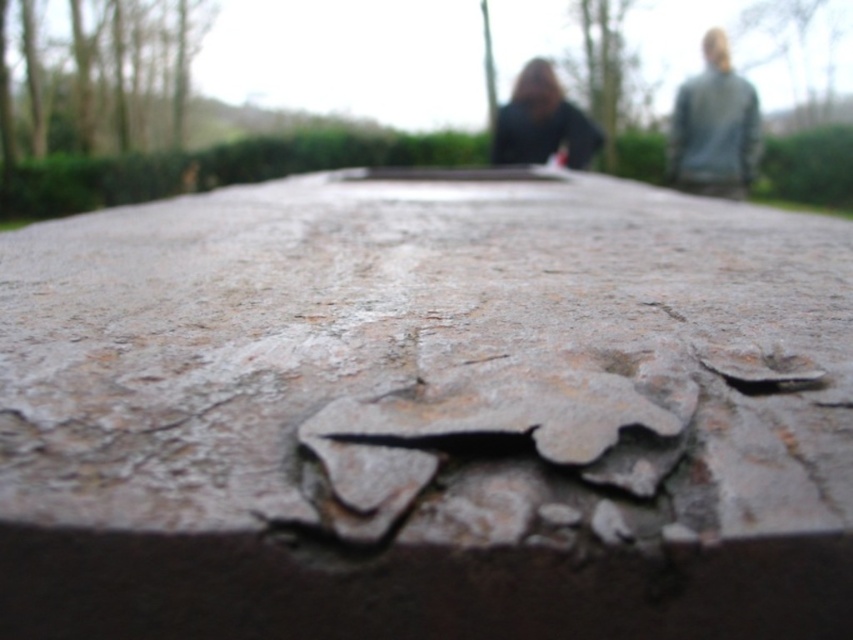
Question: Observing the image, what is the correct spatial positioning of rusty metal concrete at center in reference to gray matte jacket at upper right?

Choices:
 (A) left
 (B) right

Answer: (A)

Question: Is rusty metal concrete at center below blurred hair at upper center?

Choices:
 (A) no
 (B) yes

Answer: (B)

Question: Can you confirm if rusty metal concrete at center is positioned below matte black hair at upper center?

Choices:
 (A) yes
 (B) no

Answer: (A)

Question: Which object appears closest to the camera in this image?

Choices:
 (A) matte black hair at upper center
 (B) gray matte jacket at upper right
 (C) rusty metal concrete at center

Answer: (C)

Question: Which point is farther to the camera?

Choices:
 (A) blurred hair at upper center
 (B) rusty metal concrete at center
 (C) matte black hair at upper center

Answer: (A)

Question: Estimate the real-world distances between objects in this image. Which object is closer to the matte black hair at upper center?

Choices:
 (A) gray matte jacket at upper right
 (B) rusty metal concrete at center
 (C) blurred hair at upper center

Answer: (A)